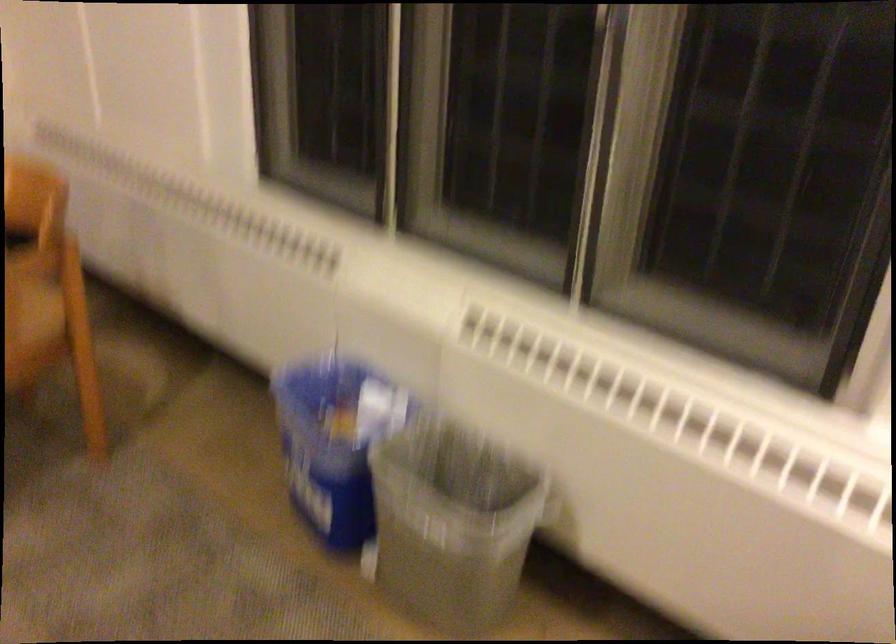
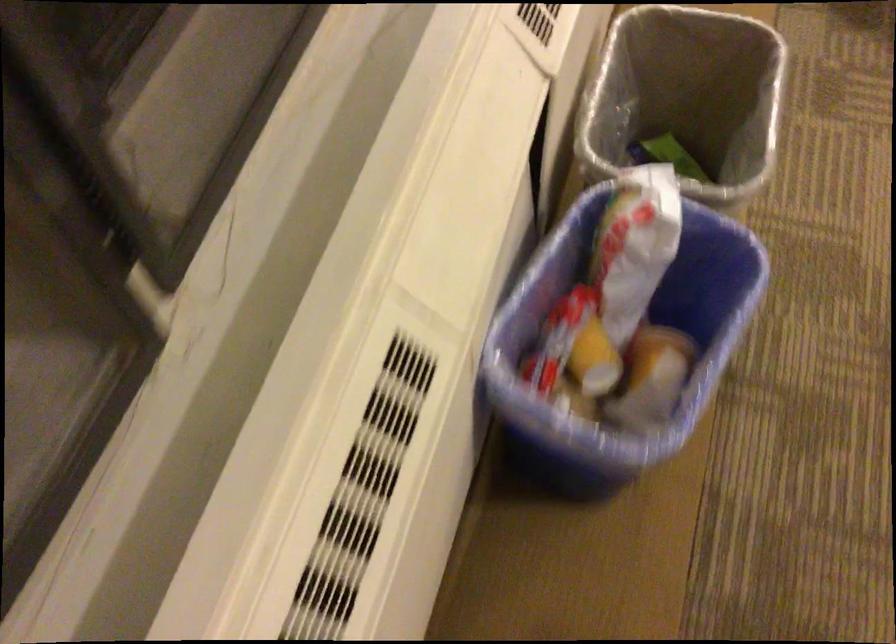
Where in the second image is the point corresponding to the point at 503,562 from the first image?

(686, 97)